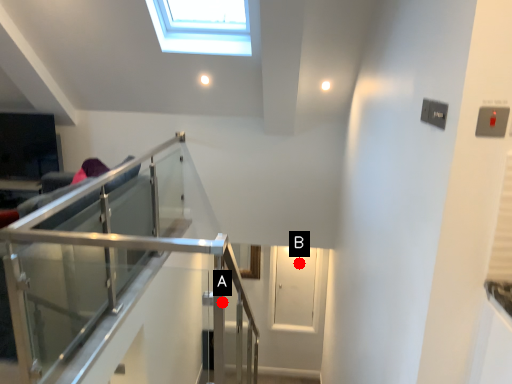
Question: Two points are circled on the image, labeled by A and B beside each circle. Which of the following is the farthest from the observer?

Choices:
 (A) A is further
 (B) B is further

Answer: (B)